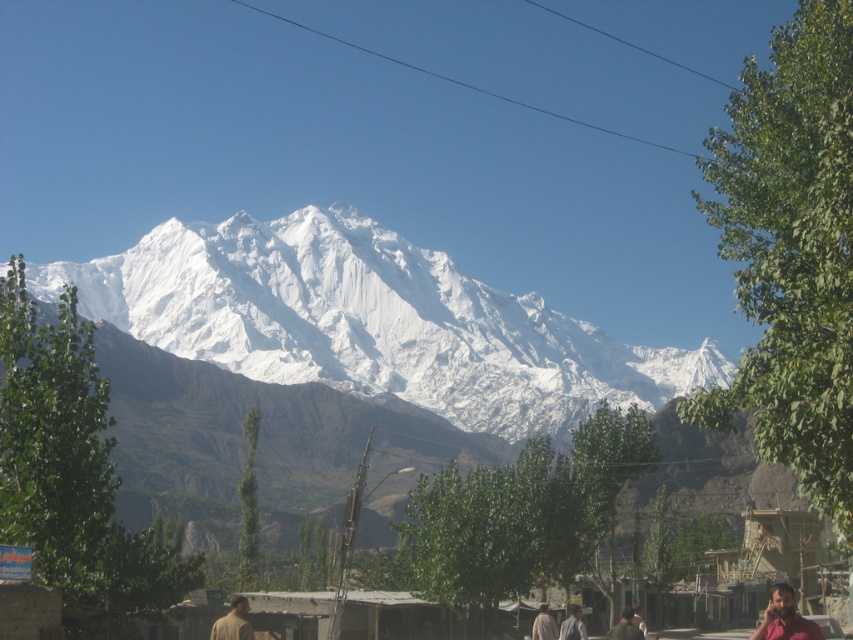
Question: Is brown matte shirt at lower center positioned in front of brown fabric person at lower right?

Choices:
 (A) no
 (B) yes

Answer: (B)

Question: Can you confirm if white snow-covered mountain range at center is positioned below brown fabric person at lower right?

Choices:
 (A) yes
 (B) no

Answer: (B)

Question: Which of the following is the closest to the observer?

Choices:
 (A) brown fabric shirt at lower center
 (B) brown matte shirt at lower center

Answer: (B)

Question: Which object appears closest to the camera in this image?

Choices:
 (A) white snow-covered mountain range at center
 (B) brown textured shirt at lower right

Answer: (B)

Question: Which point is closer to the camera?

Choices:
 (A) (621, 625)
 (B) (248, 628)
 (C) (534, 628)

Answer: (B)

Question: Is white snow-covered mountain range at center closer to camera compared to brown textured shirt at lower right?

Choices:
 (A) no
 (B) yes

Answer: (A)